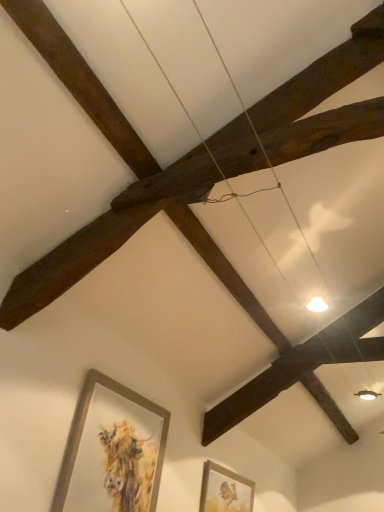
Question: Relative to gold metallic picture frame at lower left, which is the first picture frame in top-to-bottom order, is matte gold picture frame at lower right, arranged as the 2th picture frame when viewed from the top, in front or behind?

Choices:
 (A) front
 (B) behind

Answer: (B)

Question: Based on their positions, is matte gold picture frame at lower right, acting as the second picture frame starting from the front, located to the left or right of gold metallic picture frame at lower left, placed as the second picture frame when sorted from right to left?

Choices:
 (A) right
 (B) left

Answer: (A)

Question: Does point tap(220, 501) appear closer or farther from the camera than point tap(72, 433)?

Choices:
 (A) farther
 (B) closer

Answer: (A)

Question: In the image, is gold metallic picture frame at lower left, placed as the second picture frame when sorted from right to left, positioned in front of or behind matte gold picture frame at lower right, which is counted as the 1th picture frame, starting from the right?

Choices:
 (A) front
 (B) behind

Answer: (A)

Question: From the image's perspective, is gold metallic picture frame at lower left, which ranks as the first picture frame in front-to-back order, above or below matte gold picture frame at lower right, arranged as the first picture frame when ordered from the bottom?

Choices:
 (A) above
 (B) below

Answer: (A)

Question: From a real-world perspective, is gold metallic picture frame at lower left, positioned as the 2th picture frame in back-to-front order, above or below matte gold picture frame at lower right, which is counted as the 1th picture frame, starting from the right?

Choices:
 (A) below
 (B) above

Answer: (B)

Question: Considering the relative positions of gold metallic picture frame at lower left, marked as the 2th picture frame in a bottom-to-top arrangement, and matte gold picture frame at lower right, which ranks as the 2th picture frame in left-to-right order, in the image provided, is gold metallic picture frame at lower left, marked as the 2th picture frame in a bottom-to-top arrangement, to the left or to the right of matte gold picture frame at lower right, which ranks as the 2th picture frame in left-to-right order,?

Choices:
 (A) left
 (B) right

Answer: (A)